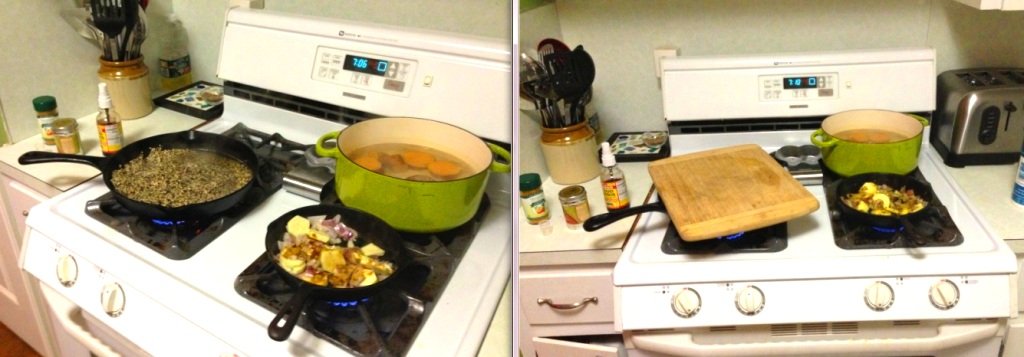
This screenshot has height=357, width=1024. In order to click on clock in this screenshot , I will do `click(360, 68)`, `click(786, 81)`.